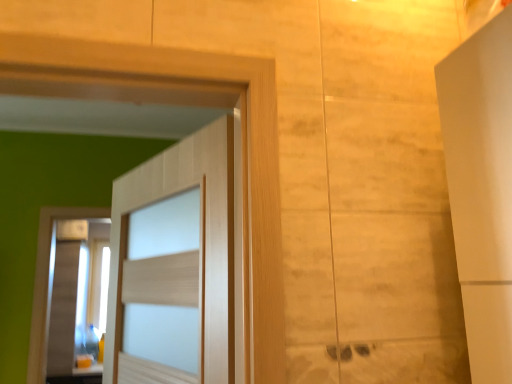
What is the approximate width of wooden door at center?

13.09 centimeters.

The height and width of the screenshot is (384, 512). What do you see at coordinates (181, 254) in the screenshot? I see `wooden door at center` at bounding box center [181, 254].

What are the coordinates of `wooden door at center` in the screenshot? It's located at (181, 254).

I want to click on wooden door at center, so click(x=181, y=254).